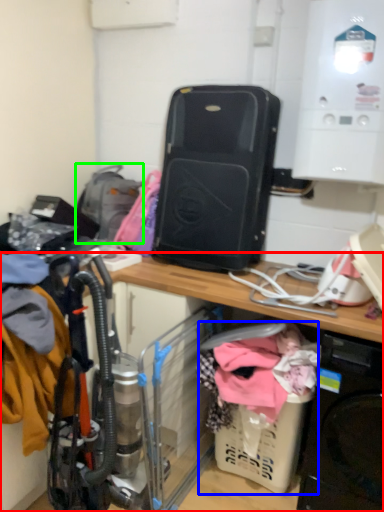
Question: Based on their relative distances, which object is farther from desk (highlighted by a red box)? Choose from baby carriage (highlighted by a blue box) and backpack (highlighted by a green box).

Choices:
 (A) baby carriage
 (B) backpack

Answer: (B)